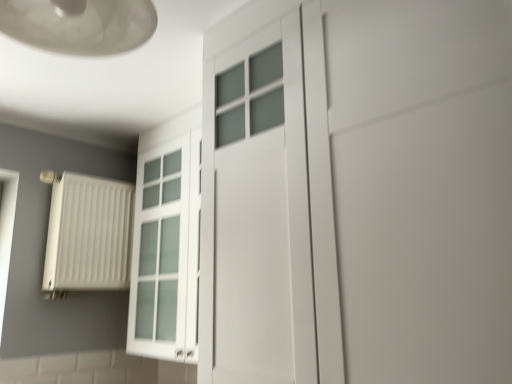
Question: From the image's perspective, is matte glass lampshade at upper left located above or below white matte door at center?

Choices:
 (A) above
 (B) below

Answer: (A)

Question: Is matte glass lampshade at upper left situated inside white matte door at center or outside?

Choices:
 (A) outside
 (B) inside

Answer: (A)

Question: Estimate the real-world distances between objects in this image. Which object is farther from the white matte radiator at left?

Choices:
 (A) white matte door at center
 (B) matte glass lampshade at upper left

Answer: (A)

Question: Estimate the real-world distances between objects in this image. Which object is farther from the matte glass lampshade at upper left?

Choices:
 (A) white matte radiator at left
 (B) white matte door at center

Answer: (A)